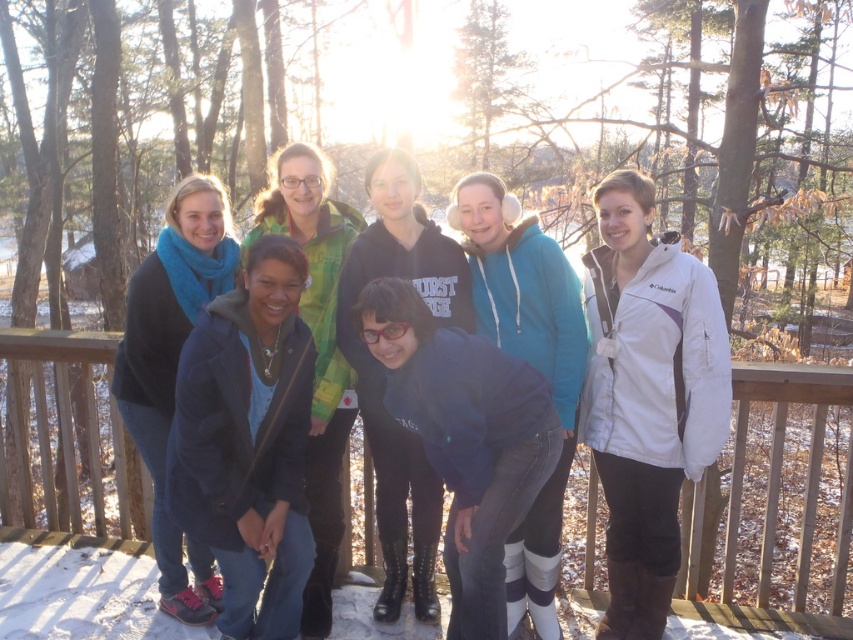
Question: Observing the image, what is the correct spatial positioning of white softshell jacket at center in reference to dark blue hoodie at center?

Choices:
 (A) below
 (B) above

Answer: (A)

Question: Estimate the real-world distances between objects in this image. Which object is farther from the white softshell jacket at center?

Choices:
 (A) navy blue jacket at center
 (B) dark blue fleece at center

Answer: (A)

Question: Estimate the real-world distances between objects in this image. Which object is farther from the white softshell jacket at center?

Choices:
 (A) matte blue hoodie at center
 (B) wooden deck at center
 (C) green matte jacket at center

Answer: (B)

Question: Which object is positioned farthest from the dark blue fleece at center?

Choices:
 (A) dark blue hoodie at center
 (B) white softshell jacket at center

Answer: (B)

Question: In this image, where is wooden deck at center located relative to dark blue fleece at center?

Choices:
 (A) left
 (B) right

Answer: (B)

Question: Is the position of white softshell jacket at center more distant than that of dark blue hoodie at center?

Choices:
 (A) yes
 (B) no

Answer: (A)